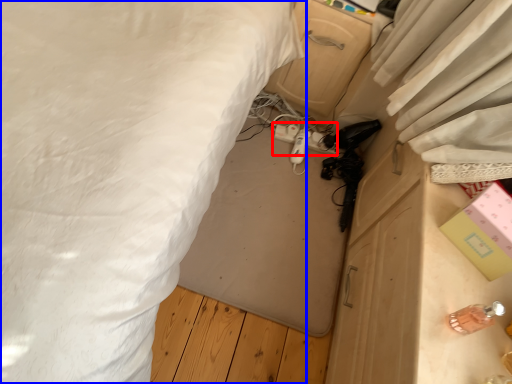
Question: Which object is further to the camera taking this photo, extension cord (highlighted by a red box) or bed (highlighted by a blue box)?

Choices:
 (A) extension cord
 (B) bed

Answer: (A)